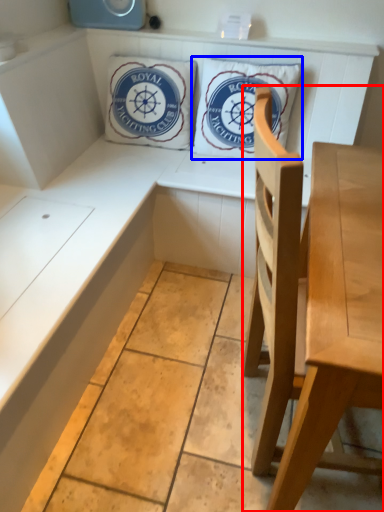
Question: Which of the following is the farthest to the observer, chair (highlighted by a red box) or pillow (highlighted by a blue box)?

Choices:
 (A) chair
 (B) pillow

Answer: (B)